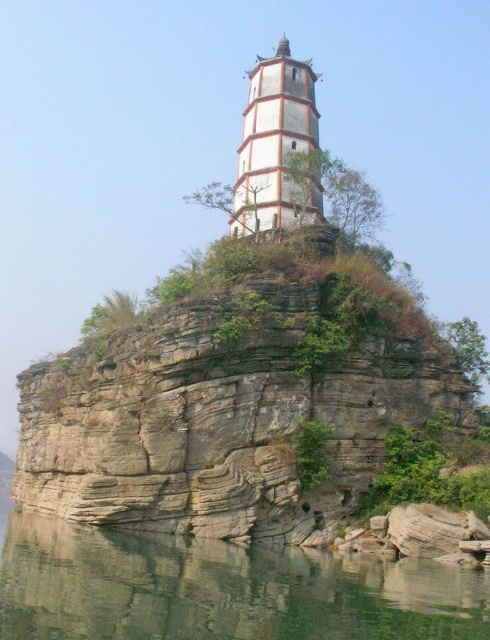
You are a photographer standing at the base of the rock formation. You want to capture both the tower and the rugged rock surface in your photo. Which of the two points, point (106, 572) or point (287, 128), is closer to you and should be prioritized in your composition?

Point (106, 572) is closer to the camera than point (287, 128), so it should be prioritized in your composition as it will appear larger and more prominent in the photo.

You are a photographer planning to take a landscape photo that emphasizes the white striped tower at center. Given the scene described, will the clear water at lower center appear larger or smaller in the photo compared to the tower?

The clear water at lower center is larger in size than the white striped tower at center, so it will appear larger in the photo.